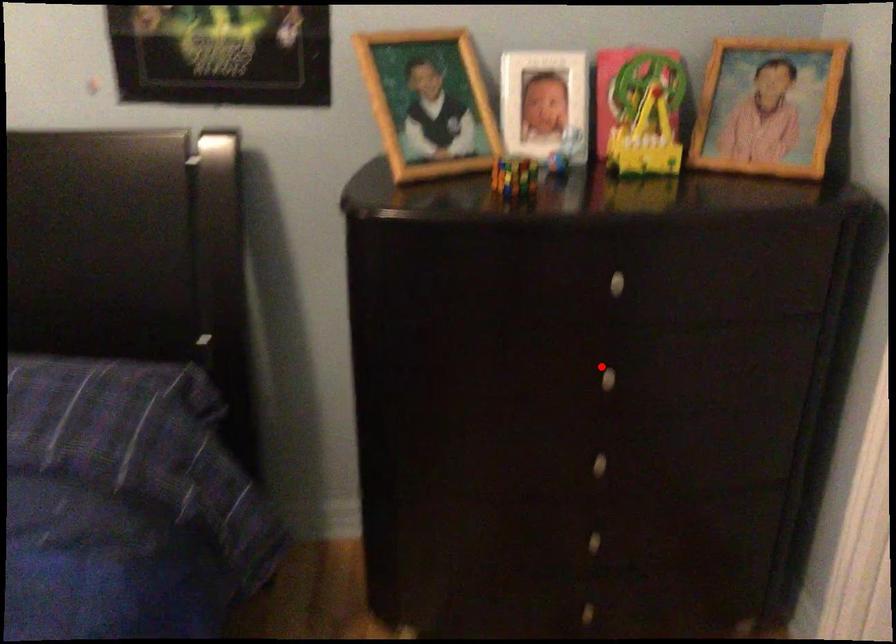
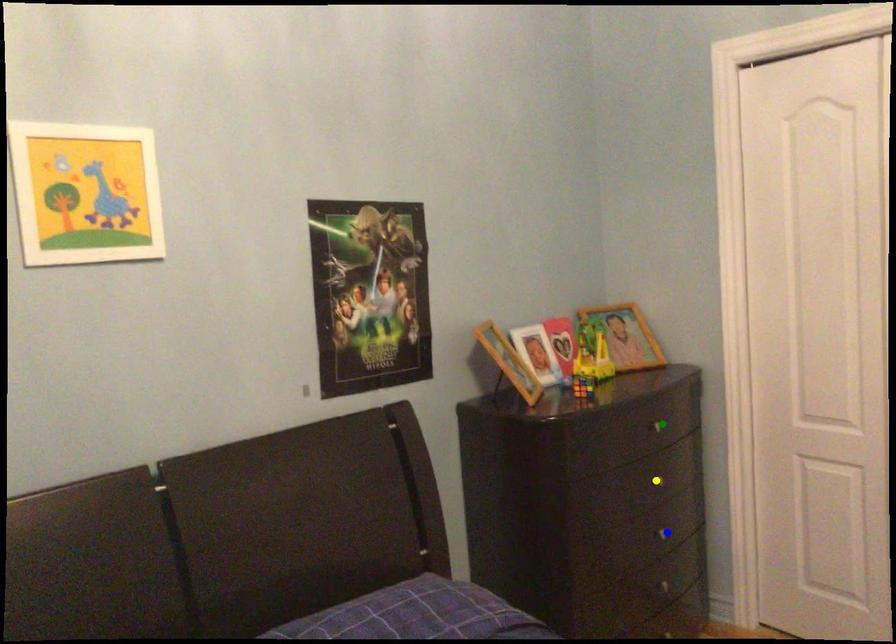
Question: I am providing you with two images of the same scene from different viewpoints. A red point is marked on the first image. You are given multiple points on the second image. Which mark in image 2 goes with the point in image 1?

Choices:
 (A) green point
 (B) yellow point
 (C) blue point

Answer: (B)